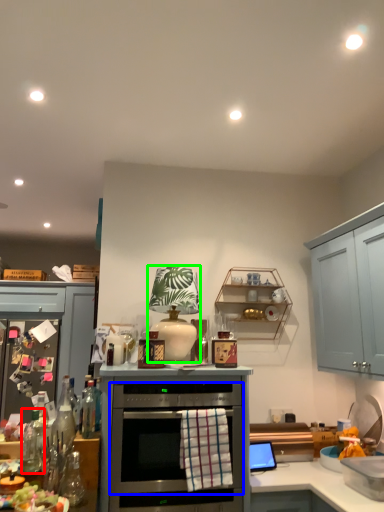
Question: Considering the real-world distances, which object is closest to bottle (highlighted by a red box)? oven (highlighted by a blue box) or appliance (highlighted by a green box).

Choices:
 (A) oven
 (B) appliance

Answer: (A)